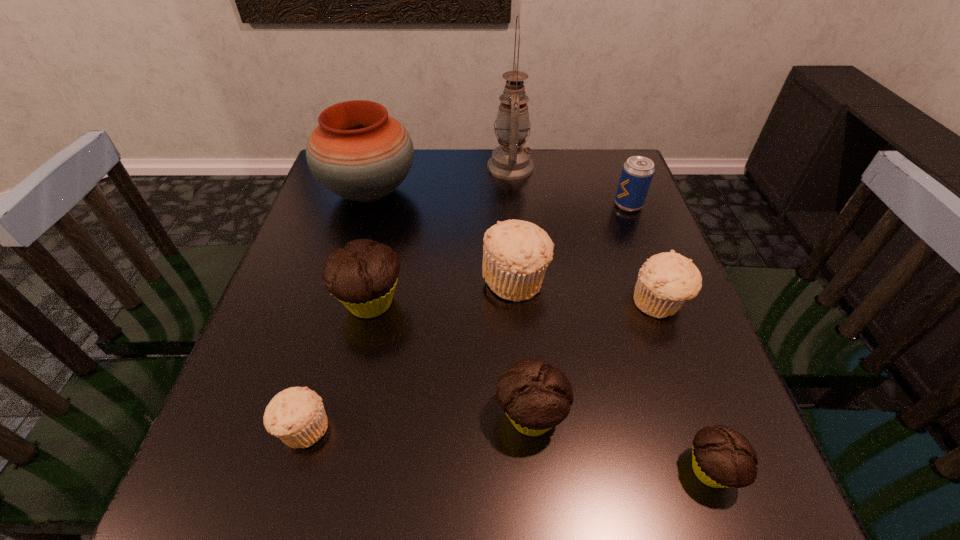
Find the location of a particular element. object that is at the near right corner is located at coordinates (721, 457).

This screenshot has width=960, height=540. In order to click on vacant area at the far edge of the desktop in this screenshot , I will do `click(435, 183)`.

You are a GUI agent. You are given a task and a screenshot of the screen. Output one action in this format:
    pyautogui.click(x=<x>, y=<y>)
    Task: Click on the vacant area at the near edge
    Image resolution: width=960 pixels, height=540 pixels.
    Given the screenshot: What is the action you would take?
    pyautogui.click(x=419, y=478)

You are a GUI agent. You are given a task and a screenshot of the screen. Output one action in this format:
    pyautogui.click(x=<x>, y=<y>)
    Task: Click on the vacant region at the left edge
    This screenshot has width=960, height=540.
    Given the screenshot: What is the action you would take?
    pyautogui.click(x=314, y=260)

Locate an element on the screen. vacant space at the right edge of the desktop is located at coordinates (668, 399).

Find the location of a particular element. The height and width of the screenshot is (540, 960). free space at the far right corner is located at coordinates (596, 163).

I want to click on free spot between the smallest chocolate muffin and the leftmost beige muffin, so click(x=507, y=449).

Where is `free space between the beer can and the rightmost chocolate muffin`? free space between the beer can and the rightmost chocolate muffin is located at coordinates (670, 338).

Locate an element on the screen. free point between the beer can and the oil lamp is located at coordinates (569, 186).

Where is `free space between the rightmost beige muffin and the leftmost beige muffin`? This screenshot has height=540, width=960. free space between the rightmost beige muffin and the leftmost beige muffin is located at coordinates pos(481,366).